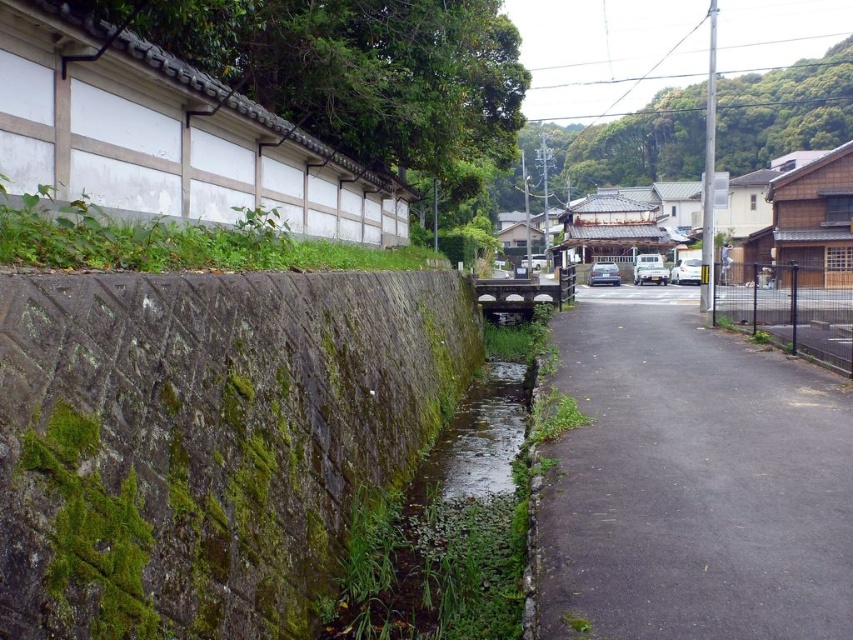
Which of these two, green mossy stone wall at left or black asphalt path at center, stands taller?

green mossy stone wall at left is taller.

What do you see at coordinates (207, 440) in the screenshot?
I see `green mossy stone wall at left` at bounding box center [207, 440].

Where is `green mossy stone wall at left`? The image size is (853, 640). green mossy stone wall at left is located at coordinates (207, 440).